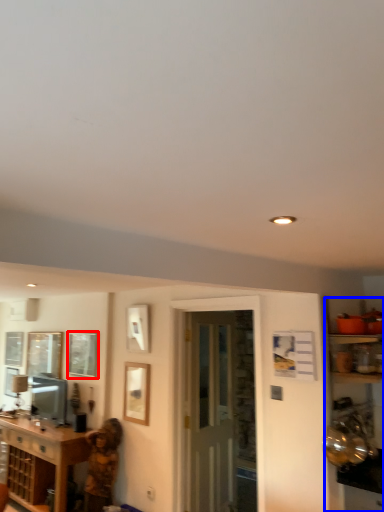
Question: Which object appears farthest to the camera in this image, window (highlighted by a red box) or entertainment center (highlighted by a blue box)?

Choices:
 (A) window
 (B) entertainment center

Answer: (A)